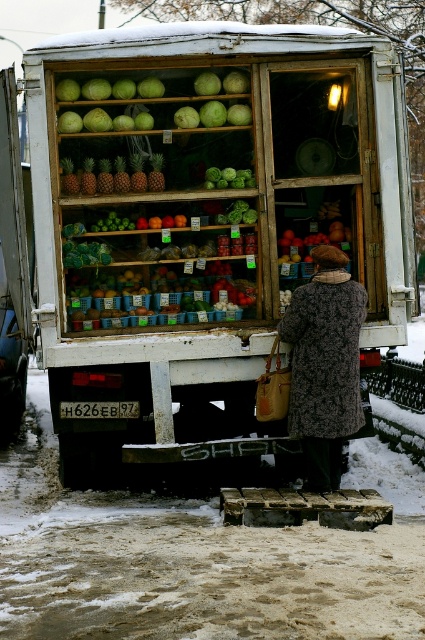
Question: Among these objects, which one is nearest to the camera?

Choices:
 (A) shiny red apples at center
 (B) white matte food truck at center
 (C) pineapple matte at center

Answer: (B)

Question: Among these objects, which one is nearest to the camera?

Choices:
 (A) white matte food truck at center
 (B) pineapple matte at center

Answer: (A)

Question: Which of the following is the farthest from the observer?

Choices:
 (A) (303, 451)
 (B) (280, 260)
 (C) (110, 164)

Answer: (B)

Question: From the image, what is the correct spatial relationship of fluffy brown coat at center in relation to pineapple matte at center?

Choices:
 (A) left
 (B) right

Answer: (B)

Question: Is fluffy brown coat at center below shiny red apples at center?

Choices:
 (A) yes
 (B) no

Answer: (A)

Question: Does fluffy brown coat at center have a smaller size compared to pineapple matte at center?

Choices:
 (A) yes
 (B) no

Answer: (B)